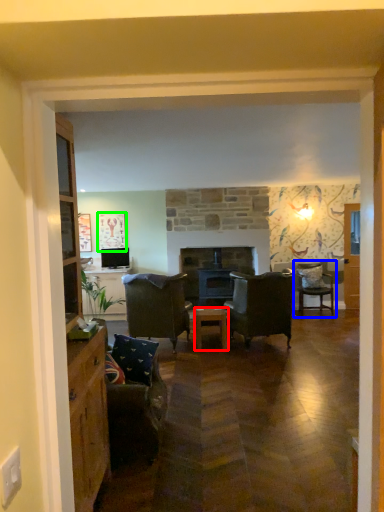
Question: Which object is positioned closest to table (highlighted by a red box)? Select from chair (highlighted by a blue box) and picture frame (highlighted by a green box).

Choices:
 (A) chair
 (B) picture frame

Answer: (B)